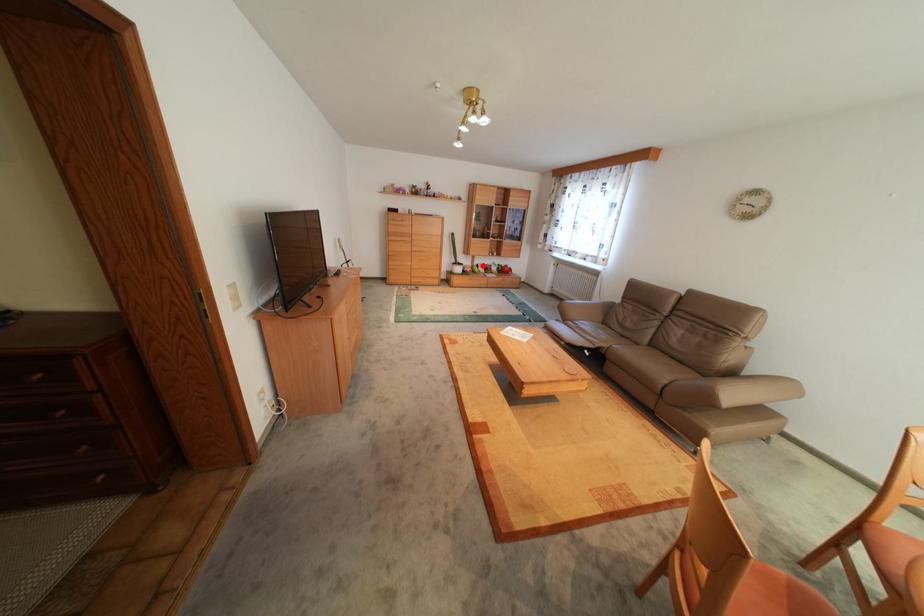
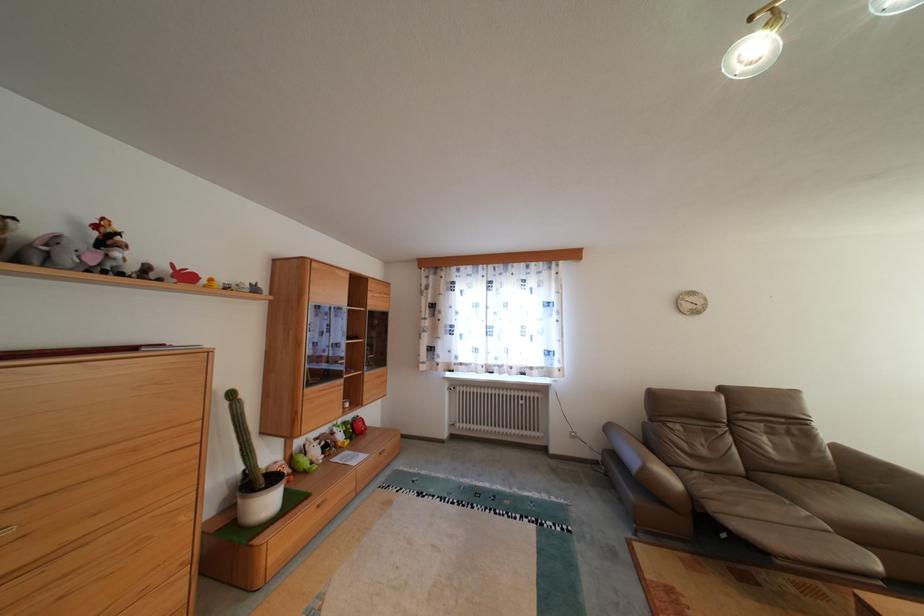
Question: I am providing you with two images of the same scene from different viewpoints. A red point is shown in image1. For the corresponding object point in image2, is it positioned nearer or farther from the camera?

Choices:
 (A) Nearer
 (B) Farther

Answer: (B)